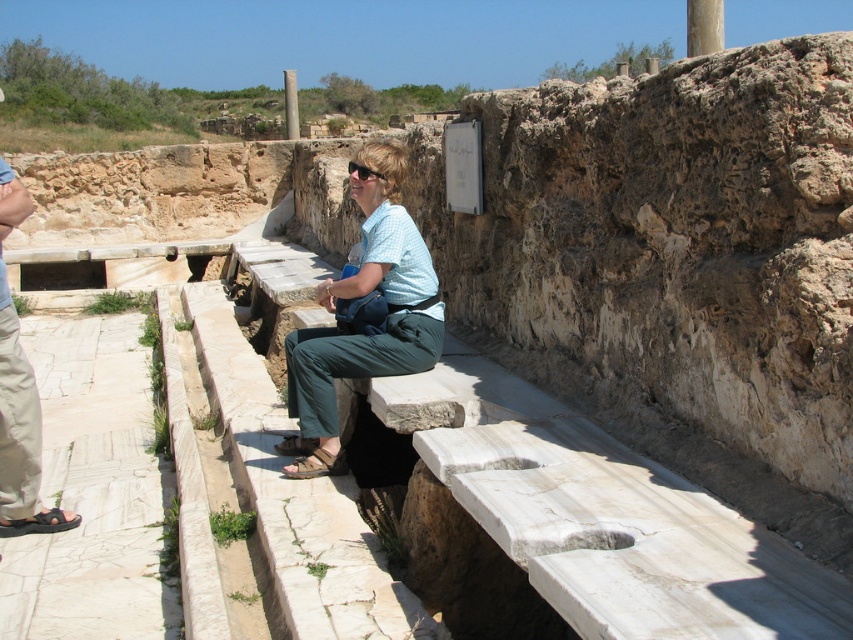
You are an archaeologist at the site and need to approach both the green fabric pants at center and the beige cotton pants at lower left. Which one should you move towards first to reach the closer one?

You should move towards the green fabric pants at center first because it is closer to you than the beige cotton pants at lower left.

You are standing at point (x=9, y=406) and want to walk to the point (x=328, y=368). Based on the scene description, is the destination point behind you or in front of you?

The destination point (x=328, y=368) is behind you because according to the objects description, point (x=328, y=368) is behind point (x=9, y=406).